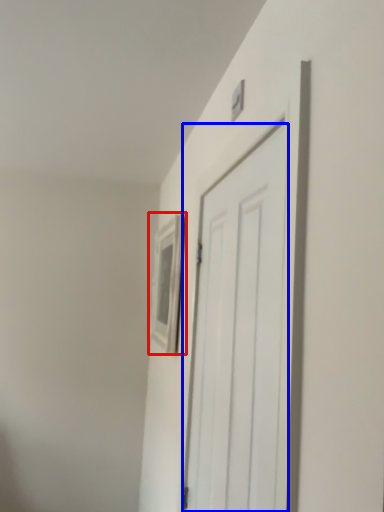
Question: Among these objects, which one is nearest to the camera, picture frame (highlighted by a red box) or door (highlighted by a blue box)?

Choices:
 (A) picture frame
 (B) door

Answer: (B)